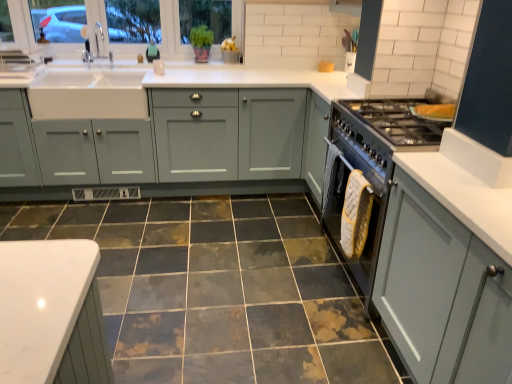
At what (x,y) coordinates should I click in order to perform the action: click on vacant space situated on the left part of teal matte soap dispenser at upper center. Please return your answer as a coordinate pair (x, y). Looking at the image, I should click on (128, 66).